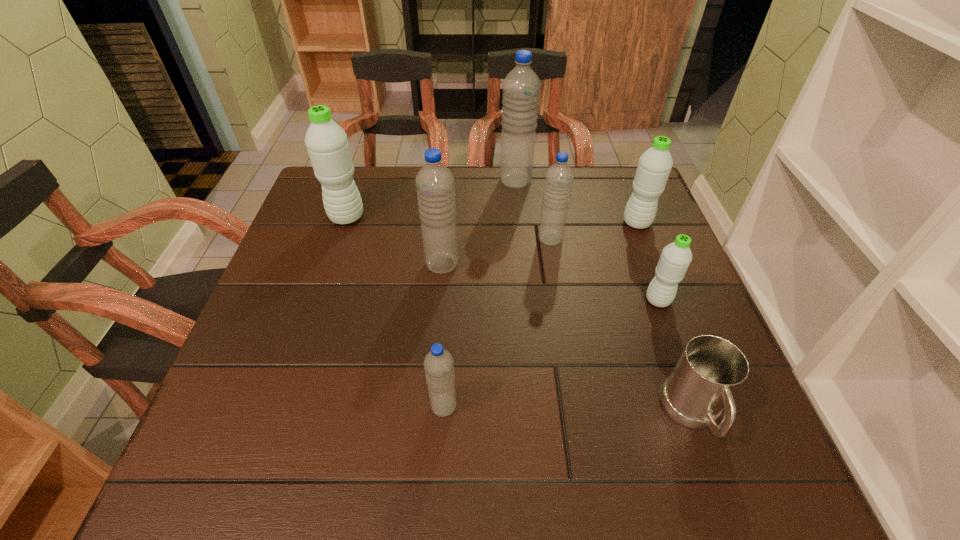
Identify the location of free space that satisfies the following two spatial constraints: 1. on the back side of the fifth farthest water bottle; 2. on the left side of the second smallest green water bottle. This screenshot has height=540, width=960. (445, 222).